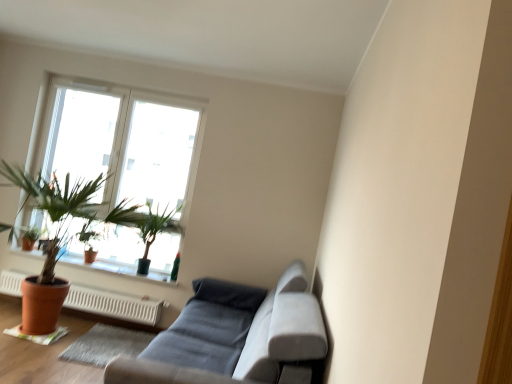
Question: Is transparent glass window at upper left thinner than green matte plant at upper left, the second houseplant from the front?

Choices:
 (A) no
 (B) yes

Answer: (B)

Question: Is the position of transparent glass window at upper left more distant than that of green matte plant at upper left, the 2th houseplant when ordered from back to front?

Choices:
 (A) no
 (B) yes

Answer: (B)

Question: Considering the relative sizes of transparent glass window at upper left and green matte plant at upper left, the second houseplant from the front, in the image provided, is transparent glass window at upper left smaller than green matte plant at upper left, the second houseplant from the front,?

Choices:
 (A) no
 (B) yes

Answer: (A)

Question: Does transparent glass window at upper left appear on the right side of green matte plant at upper left, the 2th houseplant when ordered from back to front?

Choices:
 (A) no
 (B) yes

Answer: (A)

Question: Are transparent glass window at upper left and green matte plant at upper left, the second houseplant from the front, beside each other?

Choices:
 (A) yes
 (B) no

Answer: (B)

Question: Visually, is matte terracotta pot at left, positioned as the first houseplant in back-to-front order, positioned to the left or to the right of terracotta clay pot at lower left?

Choices:
 (A) right
 (B) left

Answer: (B)

Question: Choose the correct answer: Is matte terracotta pot at left, placed as the third houseplant when sorted from front to back, inside terracotta clay pot at lower left or outside it?

Choices:
 (A) outside
 (B) inside

Answer: (A)

Question: From the image's perspective, is matte terracotta pot at left, placed as the third houseplant when sorted from front to back, located above or below terracotta clay pot at lower left?

Choices:
 (A) above
 (B) below

Answer: (A)

Question: In terms of width, does matte terracotta pot at left, placed as the third houseplant when sorted from front to back, look wider or thinner when compared to terracotta clay pot at lower left?

Choices:
 (A) wide
 (B) thin

Answer: (B)

Question: Considering the relative positions of terracotta clay pot at lower left and green matte plant at upper left, the 2th houseplant when ordered from back to front, in the image provided, is terracotta clay pot at lower left to the left or to the right of green matte plant at upper left, the 2th houseplant when ordered from back to front,?

Choices:
 (A) left
 (B) right

Answer: (A)

Question: Looking at their shapes, would you say terracotta clay pot at lower left is wider or thinner than green matte plant at upper left, the 2th houseplant when ordered from back to front?

Choices:
 (A) thin
 (B) wide

Answer: (A)

Question: Considering the positions of terracotta clay pot at lower left and green matte plant at upper left, the 2th houseplant when ordered from back to front, in the image, is terracotta clay pot at lower left bigger or smaller than green matte plant at upper left, the 2th houseplant when ordered from back to front,?

Choices:
 (A) small
 (B) big

Answer: (A)

Question: From the image's perspective, is terracotta clay pot at lower left located above or below green matte plant at upper left, the 2th houseplant when ordered from back to front?

Choices:
 (A) below
 (B) above

Answer: (A)

Question: From the image's perspective, relative to transparent glass window at upper left, is white plastic heater at lower left above or below?

Choices:
 (A) above
 (B) below

Answer: (B)

Question: From their relative heights in the image, would you say white plastic heater at lower left is taller or shorter than transparent glass window at upper left?

Choices:
 (A) tall
 (B) short

Answer: (B)